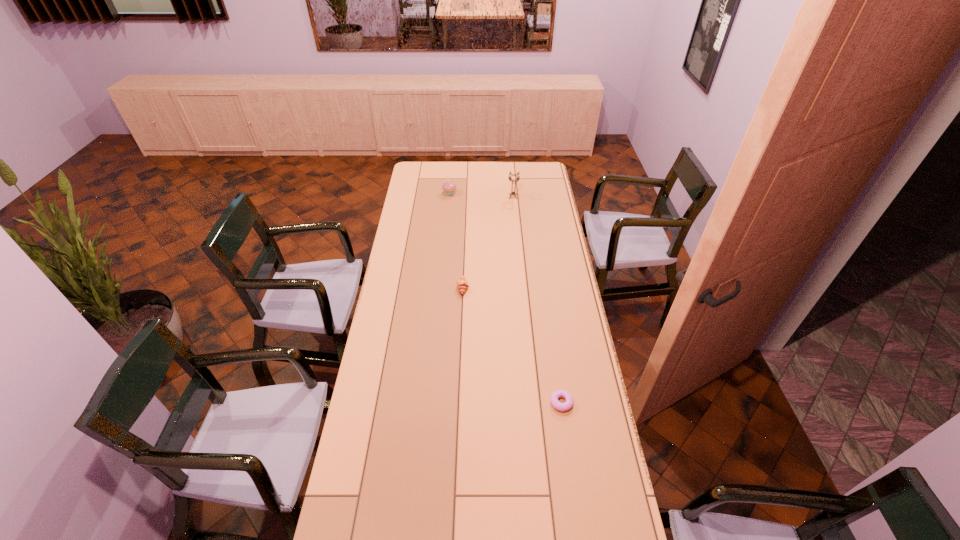
The image size is (960, 540). What are the coordinates of `candle holder` in the screenshot? It's located at (518, 177).

The height and width of the screenshot is (540, 960). In order to click on the second object from right to left in this screenshot , I will do `click(518, 177)`.

Image resolution: width=960 pixels, height=540 pixels. I want to click on the third shortest object, so click(449, 187).

What are the coordinates of `the leftmost object` in the screenshot? It's located at (449, 187).

The image size is (960, 540). In order to click on the second object from left to right in this screenshot , I will do `click(462, 285)`.

At what (x,y) coordinates should I click in order to perform the action: click on the third tallest object. Please return your answer as a coordinate pair (x, y). The width and height of the screenshot is (960, 540). Looking at the image, I should click on (462, 285).

Find the location of `doughnut`. doughnut is located at coordinates (562, 407).

The width and height of the screenshot is (960, 540). What are the coordinates of `the rightmost object` in the screenshot? It's located at (562, 407).

Image resolution: width=960 pixels, height=540 pixels. Identify the location of vacant region located 0.310m on the back of the tallest object. (510, 165).

This screenshot has height=540, width=960. I want to click on free space located 0.120m on the right of the second tallest object, so click(478, 193).